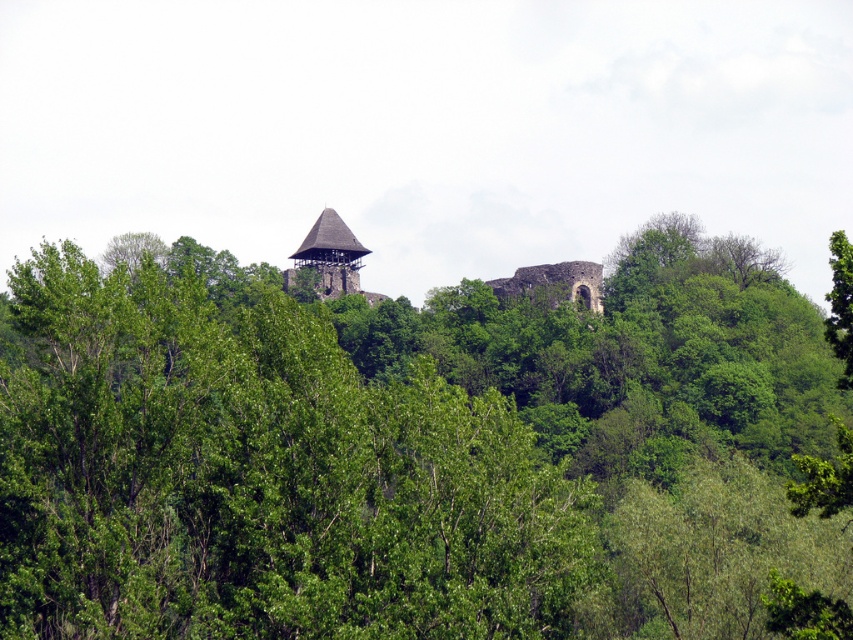
Question: Which object is closer to the camera taking this photo?

Choices:
 (A) green leafy tree at upper center
 (B) green leafy tree at upper right
 (C) brown wooden tower at center

Answer: (A)

Question: Is green leafy tree at upper center smaller than brown wooden tower at center?

Choices:
 (A) no
 (B) yes

Answer: (A)

Question: Which of the following is the closest to the observer?

Choices:
 (A) (828, 317)
 (B) (363, 291)

Answer: (A)

Question: Is the position of green leafy tree at upper center more distant than that of brown wooden tower at center?

Choices:
 (A) no
 (B) yes

Answer: (A)

Question: Is brown wooden tower at center wider than green leafy tree at upper right?

Choices:
 (A) no
 (B) yes

Answer: (A)

Question: Which point is closer to the camera?

Choices:
 (A) brown wooden tower at center
 (B) green leafy tree at upper center

Answer: (B)